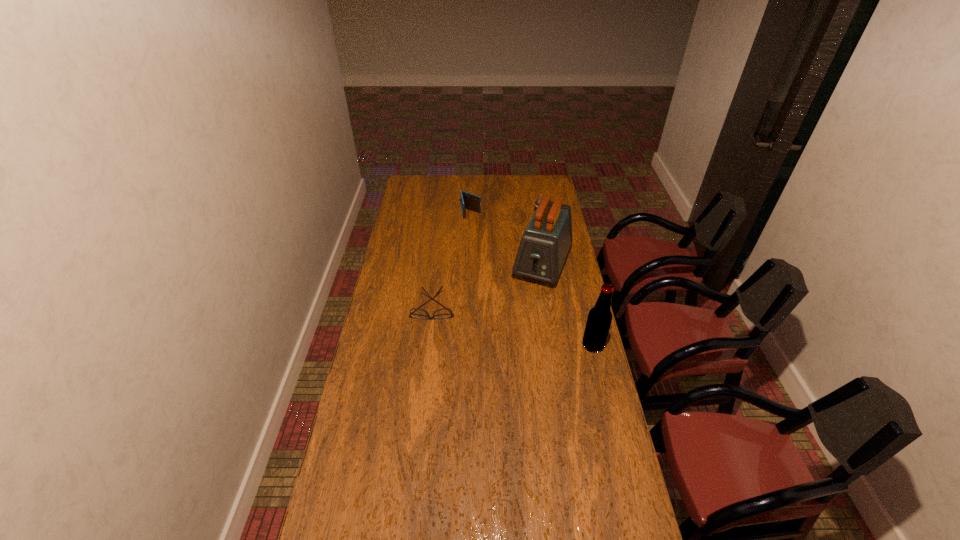
You are a GUI agent. You are given a task and a screenshot of the screen. Output one action in this format:
    pyautogui.click(x=<x>, y=<y>)
    Task: Click on the toaster that is at the right edge
    Image resolution: width=960 pixels, height=540 pixels.
    Given the screenshot: What is the action you would take?
    pyautogui.click(x=544, y=246)

Where is `vacant space at the far edge`? The image size is (960, 540). vacant space at the far edge is located at coordinates (483, 179).

Locate an element on the screen. The width and height of the screenshot is (960, 540). vacant space at the left edge of the desktop is located at coordinates (420, 199).

Find the location of `vacant area at the right edge of the desktop`. vacant area at the right edge of the desktop is located at coordinates (578, 481).

In order to click on vacant region at the far right corner of the desktop in this screenshot , I will do `click(539, 193)`.

Identify the location of free spot at the near right corner of the desktop. (605, 519).

Find the location of a particular element. The image size is (960, 540). empty space that is in between the toaster and the wallet is located at coordinates (507, 238).

This screenshot has height=540, width=960. Identify the location of empty location between the kitten and the nearest object. (565, 278).

Image resolution: width=960 pixels, height=540 pixels. What are the coordinates of `vacant space that's between the spectacles and the fourth object from right to left` in the screenshot? It's located at (452, 260).

You are a GUI agent. You are given a task and a screenshot of the screen. Output one action in this format:
    pyautogui.click(x=<x>, y=<y>)
    Task: Click on the free spot between the kitten and the wallet
    
    Given the screenshot: What is the action you would take?
    pyautogui.click(x=504, y=212)